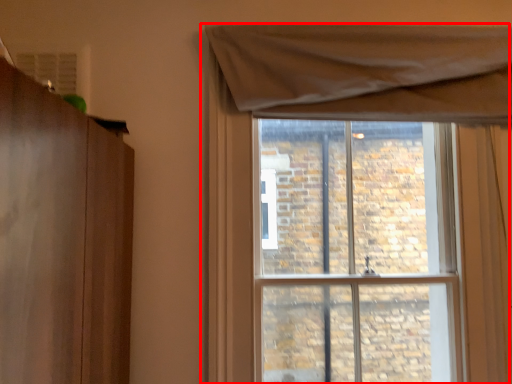
Question: From the image's perspective, where is window (annotated by the red box) located relative to window screen?

Choices:
 (A) above
 (B) below

Answer: (A)